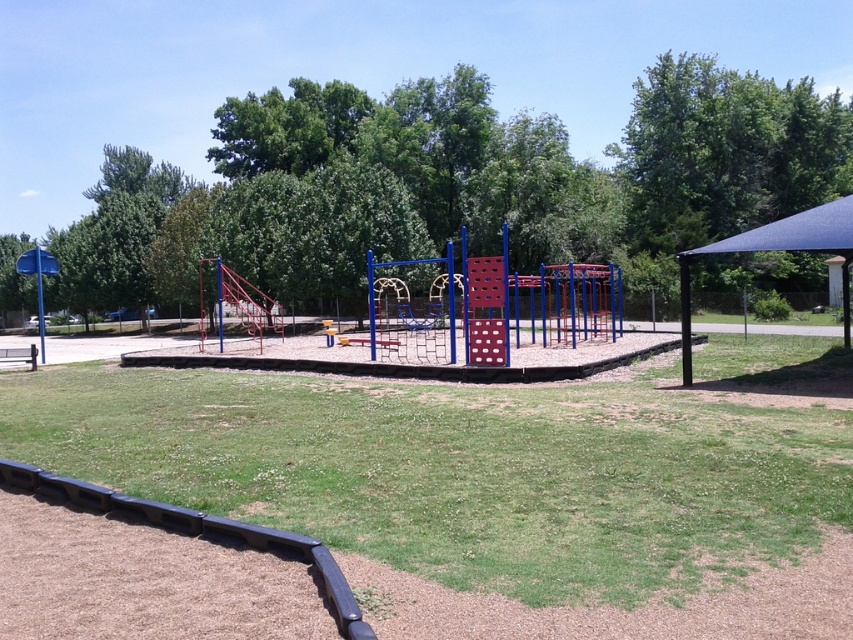
Question: Which is nearer to the green grass at center?

Choices:
 (A) green leafy tree at center
 (B) blue fabric canopy at right

Answer: (B)

Question: Among these objects, which one is nearest to the camera?

Choices:
 (A) green grass at center
 (B) blue fabric canopy at right

Answer: (A)

Question: Observing the image, what is the correct spatial positioning of green leafy tree at center in reference to blue fabric canopy at right?

Choices:
 (A) right
 (B) left

Answer: (B)

Question: Does green grass at center come behind blue fabric canopy at right?

Choices:
 (A) no
 (B) yes

Answer: (A)

Question: Which of the following is the closest to the observer?

Choices:
 (A) (822, 228)
 (B) (35, 419)
 (C) (785, 288)

Answer: (B)

Question: Is green grass at center thinner than green leafy tree at center?

Choices:
 (A) yes
 (B) no

Answer: (A)